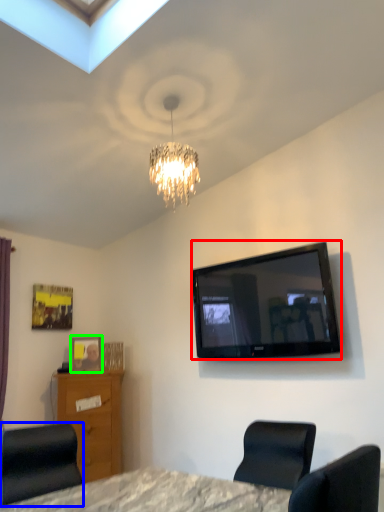
Question: Based on their relative distances, which object is farther from television (highlighted by a red box)? Choose from chair (highlighted by a blue box) and picture frame (highlighted by a green box).

Choices:
 (A) chair
 (B) picture frame

Answer: (A)